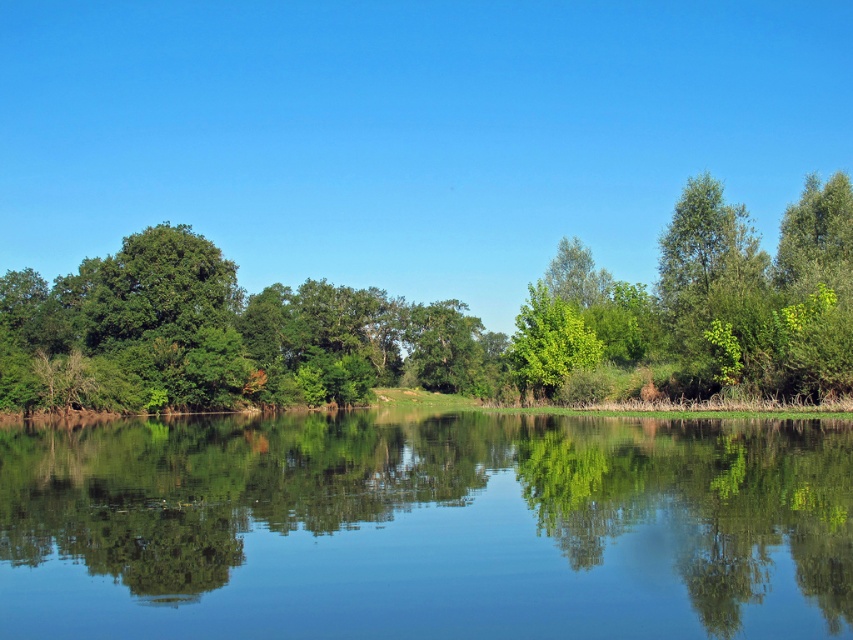
Which is above, transparent water at center or green leafy tree at left?

green leafy tree at left is above.

Is point (763, 433) more distant than point (79, 371)?

No, it is in front of (79, 371).

Which is in front, point (500, 620) or point (634, 291)?

Point (500, 620)

This screenshot has width=853, height=640. What are the coordinates of `transparent water at center` in the screenshot? It's located at [x=426, y=528].

Is point (726, 204) closer to camera compared to point (535, 340)?

That is False.

The height and width of the screenshot is (640, 853). What do you see at coordinates (439, 321) in the screenshot?
I see `green leafy tree at left` at bounding box center [439, 321].

Which is in front, point (91, 276) or point (578, 342)?

Point (578, 342) is in front.

At what (x,y) coordinates should I click in order to perform the action: click on green leafy tree at left. Please return your answer as a coordinate pair (x, y). The image size is (853, 640). Looking at the image, I should click on (439, 321).

Does point (167, 604) come in front of point (544, 390)?

That is True.

Identify the location of transparent water at center. The image size is (853, 640). (426, 528).